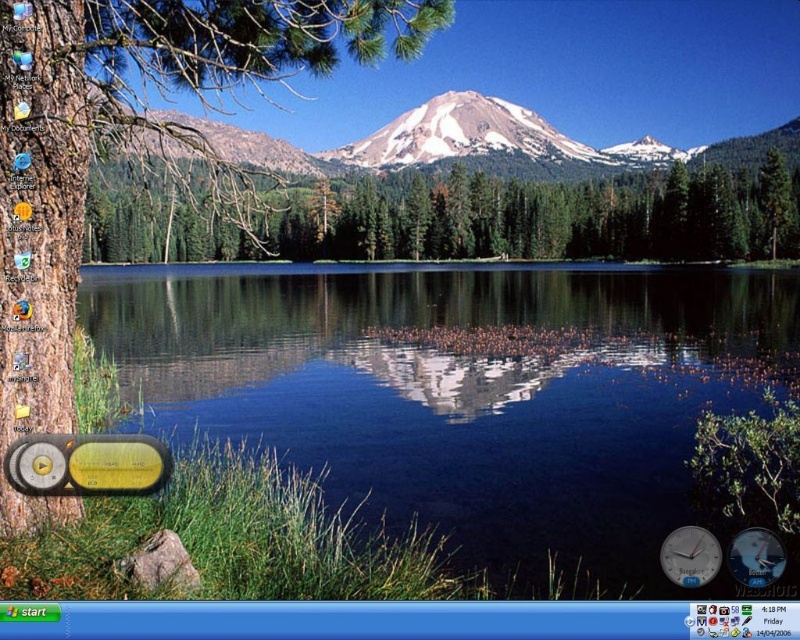
You are looking at the desktop background of a computer. You see two points marked on the screen at coordinates point (285, 4) and point (782, 150). Which point is closer to you?

Point (285, 4) is closer to the viewer than point (782, 150).

You are using a Windows desktop and want to move the brown rough bark tree at left to the center of the screen. Given that the screen has a resolution of 1920x1080 pixels, what are the coordinates where you should place it?

The coordinates to place the brown rough bark tree at left at the center of the screen would be at point (799, 639). Since the screen resolution is 1920x1080, the center is calculated by dividing both width and height by 2, resulting in 960 and 540 respectively.